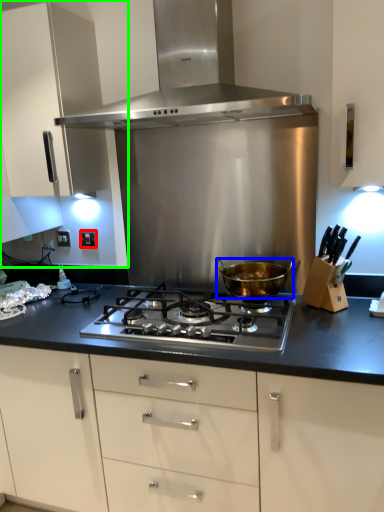
Question: Which object is the farthest from electric outlet (highlighted by a red box)? Choose among these: kitchen appliance (highlighted by a blue box) or cabinetry (highlighted by a green box).

Choices:
 (A) kitchen appliance
 (B) cabinetry

Answer: (A)